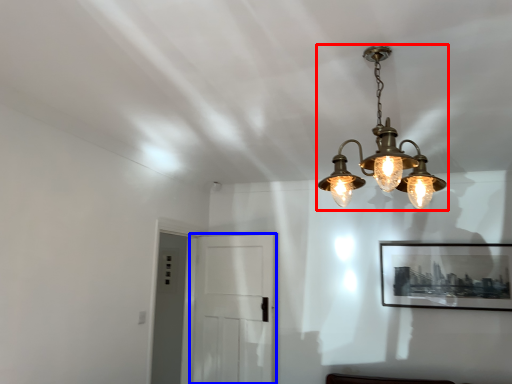
Question: Which of the following is the farthest to the observer, lamp (highlighted by a red box) or glass door (highlighted by a blue box)?

Choices:
 (A) lamp
 (B) glass door

Answer: (B)